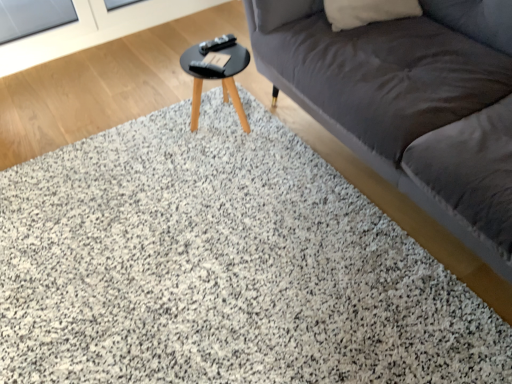
Question: From a real-world perspective, is dark gray fabric couch at upper right on top of transparent glass screen door at upper left?

Choices:
 (A) no
 (B) yes

Answer: (B)

Question: Can you confirm if dark gray fabric couch at upper right is wider than transparent glass screen door at upper left?

Choices:
 (A) no
 (B) yes

Answer: (B)

Question: Does dark gray fabric couch at upper right come behind transparent glass screen door at upper left?

Choices:
 (A) yes
 (B) no

Answer: (B)

Question: Considering the relative positions of dark gray fabric couch at upper right and transparent glass screen door at upper left in the image provided, is dark gray fabric couch at upper right to the left of transparent glass screen door at upper left from the viewer's perspective?

Choices:
 (A) no
 (B) yes

Answer: (A)

Question: Is dark gray fabric couch at upper right bigger than transparent glass screen door at upper left?

Choices:
 (A) yes
 (B) no

Answer: (A)

Question: Is dark gray fabric couch at upper right taller than transparent glass screen door at upper left?

Choices:
 (A) yes
 (B) no

Answer: (A)

Question: Could dark gray fabric couch at upper right be considered to be inside transparent glass screen door at upper left?

Choices:
 (A) yes
 (B) no

Answer: (B)

Question: Can you confirm if transparent glass screen door at upper left is bigger than dark gray fabric couch at upper right?

Choices:
 (A) no
 (B) yes

Answer: (A)

Question: Is transparent glass screen door at upper left at the left side of dark gray fabric couch at upper right?

Choices:
 (A) no
 (B) yes

Answer: (B)

Question: Can we say transparent glass screen door at upper left lies outside dark gray fabric couch at upper right?

Choices:
 (A) no
 (B) yes

Answer: (B)

Question: From a real-world perspective, is transparent glass screen door at upper left positioned over dark gray fabric couch at upper right based on gravity?

Choices:
 (A) no
 (B) yes

Answer: (A)

Question: Is transparent glass screen door at upper left to the right of dark gray fabric couch at upper right from the viewer's perspective?

Choices:
 (A) no
 (B) yes

Answer: (A)

Question: From the image's perspective, is black glossy table at center located above white soft pillow at upper right?

Choices:
 (A) no
 (B) yes

Answer: (A)